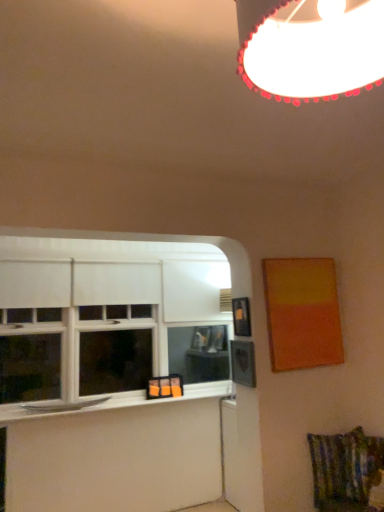
What do you see at coordinates (241, 317) in the screenshot? Image resolution: width=384 pixels, height=512 pixels. I see `black plastic picture frame at upper right, placed as the first picture frame when sorted from left to right` at bounding box center [241, 317].

In the scene shown: What is the approximate width of white matte window at lower left?

6.67 inches.

This screenshot has width=384, height=512. Describe the element at coordinates (115, 316) in the screenshot. I see `white matte window at lower left` at that location.

The width and height of the screenshot is (384, 512). What are the coordinates of `white glossy window sill at lower left` in the screenshot? It's located at (116, 402).

What is the approximate width of white glossy window sill at lower left?

white glossy window sill at lower left is 7.34 inches wide.

Find the location of `black plastic picture frame at upper right, the second picture frame viewed from the right`. black plastic picture frame at upper right, the second picture frame viewed from the right is located at coordinates (241, 317).

Can you confirm if white glossy lampshade at upper center is taller than textured multicolored fabric swivel chair at lower right?

Incorrect, the height of white glossy lampshade at upper center is not larger of that of textured multicolored fabric swivel chair at lower right.

Is white glossy lampshade at upper center far away from textured multicolored fabric swivel chair at lower right?

Indeed, white glossy lampshade at upper center is not near textured multicolored fabric swivel chair at lower right.

From a real-world perspective, between white glossy lampshade at upper center and textured multicolored fabric swivel chair at lower right, who is vertically lower?

textured multicolored fabric swivel chair at lower right.

Is white glossy lampshade at upper center bigger or smaller than textured multicolored fabric swivel chair at lower right?

In the image, white glossy lampshade at upper center appears to be larger than textured multicolored fabric swivel chair at lower right.

Would you say white glossy lampshade at upper center is part of black plastic picture frame at upper right, placed as the first picture frame when sorted from left to right,'s contents?

No, black plastic picture frame at upper right, placed as the first picture frame when sorted from left to right, does not contain white glossy lampshade at upper center.

Considering the relative sizes of black plastic picture frame at upper right, the second picture frame viewed from the right, and white glossy lampshade at upper center in the image provided, is black plastic picture frame at upper right, the second picture frame viewed from the right, bigger than white glossy lampshade at upper center?

Incorrect, black plastic picture frame at upper right, the second picture frame viewed from the right, is not larger than white glossy lampshade at upper center.

From the image's perspective, is black plastic picture frame at upper right, the second picture frame viewed from the right, located beneath white glossy lampshade at upper center?

Yes, from the image's perspective, black plastic picture frame at upper right, the second picture frame viewed from the right, is below white glossy lampshade at upper center.

Based on the photo, is white glossy lampshade at upper center closer to the viewer compared to matte orange painting at right, the first picture frame in the right-to-left sequence?

Yes, white glossy lampshade at upper center is closer to the viewer.

Considering the relative sizes of white glossy lampshade at upper center and matte orange painting at right, the first picture frame in the right-to-left sequence, in the image provided, is white glossy lampshade at upper center taller than matte orange painting at right, the first picture frame in the right-to-left sequence,?

No.

How much distance is there between white glossy lampshade at upper center and matte orange painting at right, which is the 2th picture frame in left-to-right order?

white glossy lampshade at upper center is 7.53 feet away from matte orange painting at right, which is the 2th picture frame in left-to-right order.

From the image's perspective, does black plastic picture frame at upper right, placed as the first picture frame when sorted from left to right, appear higher than white glossy window sill at lower left?

Yes, from the image's perspective, black plastic picture frame at upper right, placed as the first picture frame when sorted from left to right, is above white glossy window sill at lower left.

Consider the image. Are black plastic picture frame at upper right, placed as the first picture frame when sorted from left to right, and white glossy window sill at lower left far apart?

That's right, there is a large distance between black plastic picture frame at upper right, placed as the first picture frame when sorted from left to right, and white glossy window sill at lower left.

From the picture: In terms of height, does black plastic picture frame at upper right, the second picture frame viewed from the right, look taller or shorter compared to white glossy window sill at lower left?

In the image, black plastic picture frame at upper right, the second picture frame viewed from the right, appears to be taller than white glossy window sill at lower left.

From a real-world perspective, is textured multicolored fabric swivel chair at lower right positioned above or below white matte window at lower left?

From a real-world perspective, textured multicolored fabric swivel chair at lower right is physically below white matte window at lower left.

Considering the relative sizes of textured multicolored fabric swivel chair at lower right and white matte window at lower left in the image provided, is textured multicolored fabric swivel chair at lower right shorter than white matte window at lower left?

Indeed, textured multicolored fabric swivel chair at lower right has a lesser height compared to white matte window at lower left.

From the image's perspective, is textured multicolored fabric swivel chair at lower right beneath white matte window at lower left?

Correct, textured multicolored fabric swivel chair at lower right appears lower than white matte window at lower left in the image.

Is textured multicolored fabric swivel chair at lower right far from white matte window at lower left?

textured multicolored fabric swivel chair at lower right is positioned a significant distance from white matte window at lower left.

Is white glossy window sill at lower left facing towards black plastic picture frame at upper right, placed as the first picture frame when sorted from left to right?

No, white glossy window sill at lower left is not oriented towards black plastic picture frame at upper right, placed as the first picture frame when sorted from left to right.

In the scene shown: Is white glossy window sill at lower left in front of black plastic picture frame at upper right, placed as the first picture frame when sorted from left to right?

No, it is not.

Is white glossy window sill at lower left to the left of black plastic picture frame at upper right, the second picture frame viewed from the right, from the viewer's perspective?

Indeed, white glossy window sill at lower left is positioned on the left side of black plastic picture frame at upper right, the second picture frame viewed from the right.

Based on the photo, from the image's perspective, is white glossy window sill at lower left on black plastic picture frame at upper right, placed as the first picture frame when sorted from left to right?

Incorrect, from the image's perspective, white glossy window sill at lower left is lower than black plastic picture frame at upper right, placed as the first picture frame when sorted from left to right.

Considering the relative sizes of white glossy lampshade at upper center and white matte window at lower left in the image provided, is white glossy lampshade at upper center wider than white matte window at lower left?

Indeed, white glossy lampshade at upper center has a greater width compared to white matte window at lower left.

Is white glossy lampshade at upper center bigger than white matte window at lower left?

No.

Who is shorter, white glossy lampshade at upper center or white matte window at lower left?

white glossy lampshade at upper center is shorter.

Which is closer to the camera, (273, 75) or (54, 328)?

Point (273, 75).

This screenshot has width=384, height=512. Identify the location of lamp on the left of textured multicolored fabric swivel chair at lower right. (310, 47).

Where is `lamp above the black plastic picture frame at upper right, placed as the first picture frame when sorted from left to right (from the image's perspective)`? The width and height of the screenshot is (384, 512). lamp above the black plastic picture frame at upper right, placed as the first picture frame when sorted from left to right (from the image's perspective) is located at coordinates (310, 47).

Based on their spatial positions, is black plastic picture frame at upper right, the second picture frame viewed from the right, or textured multicolored fabric swivel chair at lower right further from white matte window at lower left?

Based on the image, textured multicolored fabric swivel chair at lower right appears to be further to white matte window at lower left.

When comparing their distances from textured multicolored fabric swivel chair at lower right, does matte orange painting at right, the first picture frame in the right-to-left sequence, or white glossy window sill at lower left seem closer?

matte orange painting at right, the first picture frame in the right-to-left sequence.

Based on their spatial positions, is white glossy window sill at lower left or white glossy lampshade at upper center further from black plastic picture frame at upper right, the second picture frame viewed from the right?

white glossy lampshade at upper center is positioned further to the anchor black plastic picture frame at upper right, the second picture frame viewed from the right.

Looking at the image, which one is located further to white glossy lampshade at upper center, white glossy window sill at lower left or textured multicolored fabric swivel chair at lower right?

Among the two, white glossy window sill at lower left is located further to white glossy lampshade at upper center.

Based on their spatial positions, is white glossy lampshade at upper center or white glossy window sill at lower left further from textured multicolored fabric swivel chair at lower right?

white glossy lampshade at upper center lies further to textured multicolored fabric swivel chair at lower right than the other object.

Based on their spatial positions, is white glossy window sill at lower left or matte orange painting at right, the first picture frame in the right-to-left sequence, closer to white matte window at lower left?

The object closer to white matte window at lower left is white glossy window sill at lower left.

Estimate the real-world distances between objects in this image. Which object is further from matte orange painting at right, which is the 2th picture frame in left-to-right order, white glossy lampshade at upper center or white matte window at lower left?

white glossy lampshade at upper center lies further to matte orange painting at right, which is the 2th picture frame in left-to-right order, than the other object.

When comparing their distances from white matte window at lower left, does matte orange painting at right, the first picture frame in the right-to-left sequence, or white glossy lampshade at upper center seem further?

white glossy lampshade at upper center is further to white matte window at lower left.

Where is `picture frame between white glossy window sill at lower left and matte orange painting at right, which is the 2th picture frame in left-to-right order, in the horizontal direction`? picture frame between white glossy window sill at lower left and matte orange painting at right, which is the 2th picture frame in left-to-right order, in the horizontal direction is located at coordinates (241, 317).

Identify the location of swivel chair between white glossy lampshade at upper center and white glossy window sill at lower left from front to back. (347, 472).

Where is `picture frame between matte orange painting at right, which is the 2th picture frame in left-to-right order, and textured multicolored fabric swivel chair at lower right from top to bottom`? picture frame between matte orange painting at right, which is the 2th picture frame in left-to-right order, and textured multicolored fabric swivel chair at lower right from top to bottom is located at coordinates (241, 317).

Locate an element on the screen. The width and height of the screenshot is (384, 512). swivel chair between white glossy lampshade at upper center and white matte window at lower left in the front-back direction is located at coordinates (347, 472).